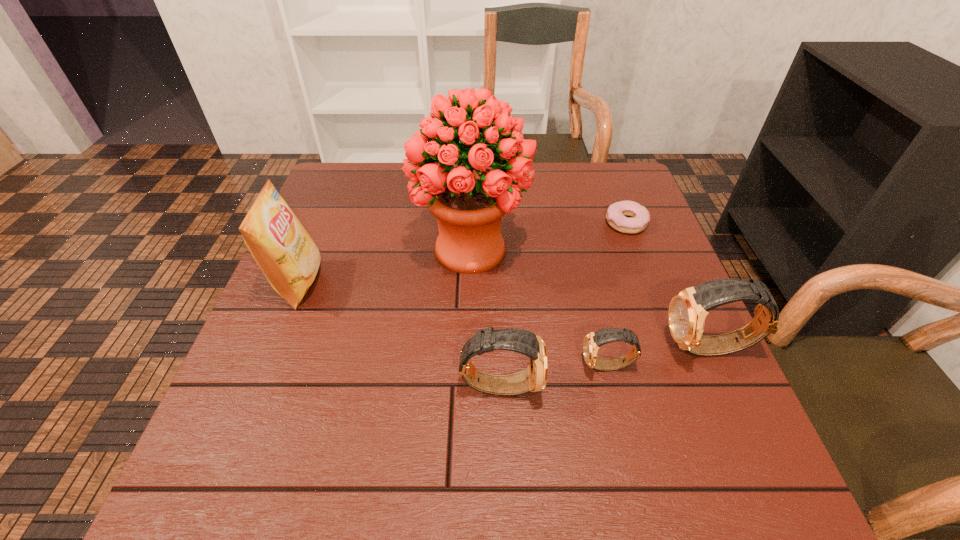
All watchs are currently evenly spaced. To continue this pattern, where would you add another watch on the left? Please point out a vacant spot. Please provide its 2D coordinates. Your answer should be formatted as a tuple, i.e. [(x, y)], where the tuple contains the x and y coordinates of a point satisfying the conditions above.

[(383, 405)]